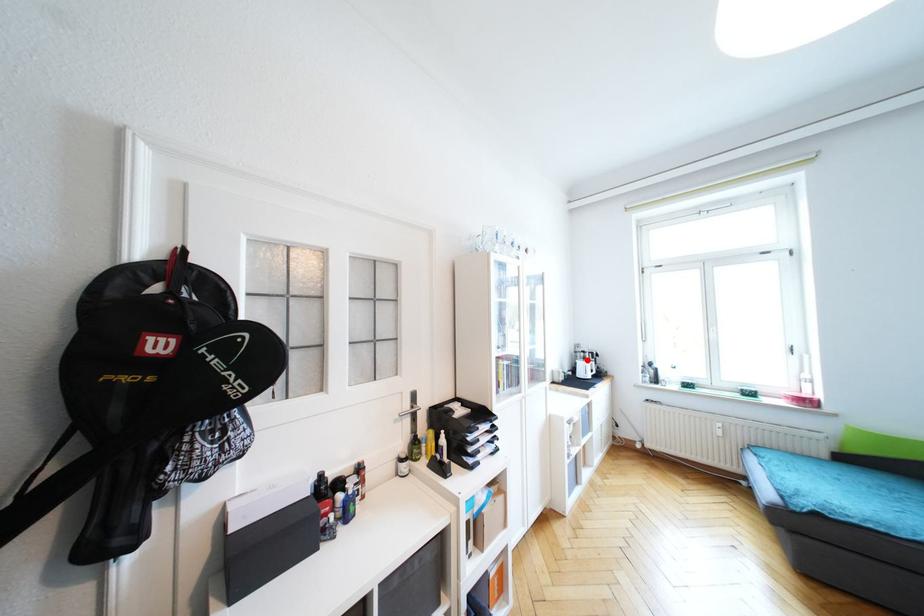
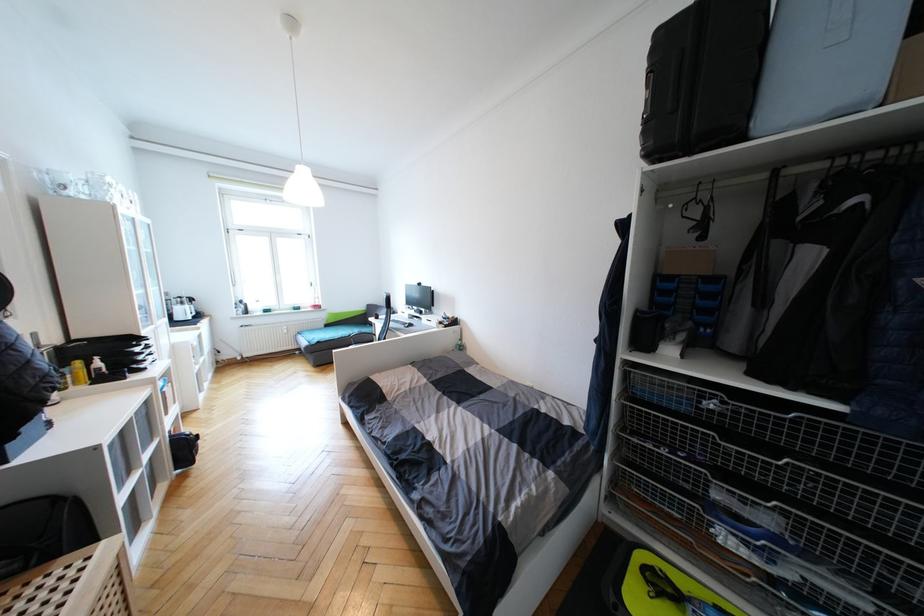
Find the pixel in the second image that matches the highlighted location in the first image.

(186, 305)